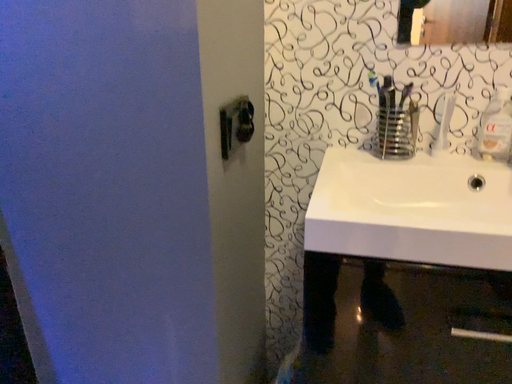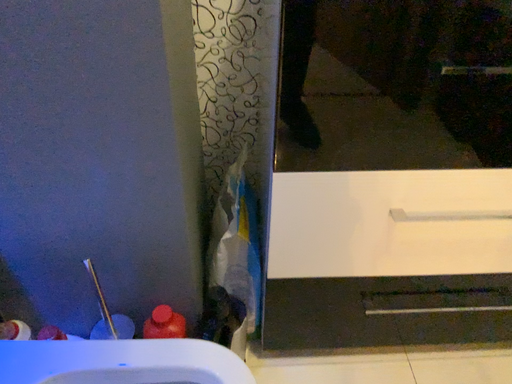
Question: Which way did the camera rotate in the video?

Choices:
 (A) rotated right
 (B) rotated left

Answer: (A)